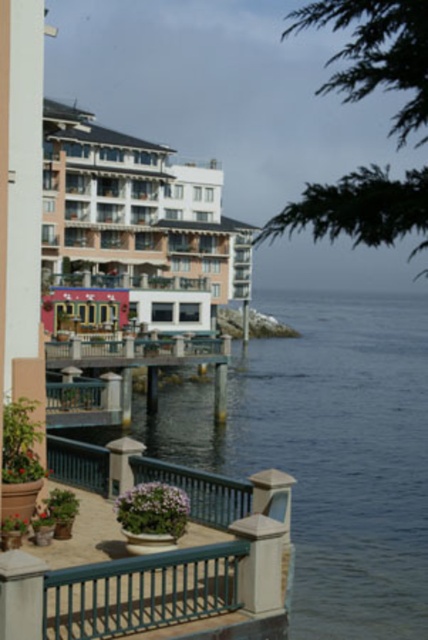
You are standing on the wooden dock at lower left and want to reach the beige stucco hotel at center. If your walking speed is 1.5 meters per second, how many seconds will it take to walk directly to the hotel?

The distance between the beige stucco hotel at center and the wooden dock at lower left is 32.04 meters. At a walking speed of 1.5 meters per second, it would take approximately 21.36 seconds to walk directly to the hotel.

You are standing on the wooden dock at lower left and want to take a photo of the beige stucco hotel at center. Based on their sizes, which object should appear bigger in your photo?

The beige stucco hotel at center should appear bigger in the photo because it is larger in size than the wooden dock at lower left.